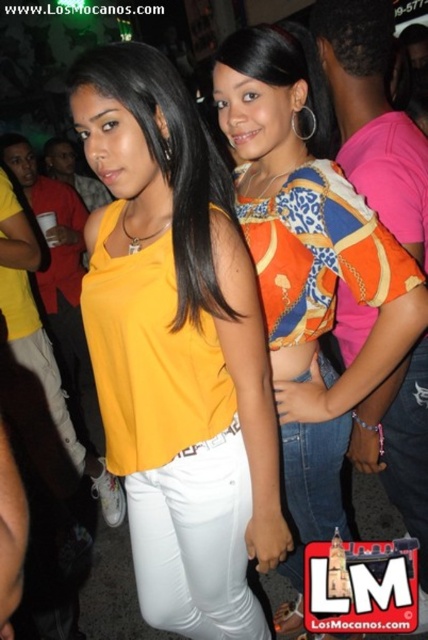
You are at a party and want to take a photo of the two points in the image. The first point is at coordinates point (x=82, y=102) and the second point is at coordinates point (x=279, y=305). Which point should you focus on first to ensure both are in the frame?

You should focus on point (x=82, y=102) first because it is closer to the viewer than point (x=279, y=305), ensuring both points remain in the frame.

You are organizing a photoshoot and need to ensure that both the matte yellow blouse at center and the orange printed blouse at center are visible in the frame. Given their sizes, which blouse might require you to adjust the camera angle to ensure it fits within the shot?

The orange printed blouse at center occupies more space than the matte yellow blouse at center, so it might require adjusting the camera angle to ensure it fits within the shot.

You are a photographer at the party and want to capture both the matte yellow blouse at center and the orange printed blouse at center in a single shot. Since the camera can only focus on one subject at a time, which blouse should you focus on to ensure the other remains in the background?

You should focus on the orange printed blouse at center because the matte yellow blouse at center is located below it, meaning the orange printed blouse is closer to the camera and will keep the matte yellow blouse in the background.